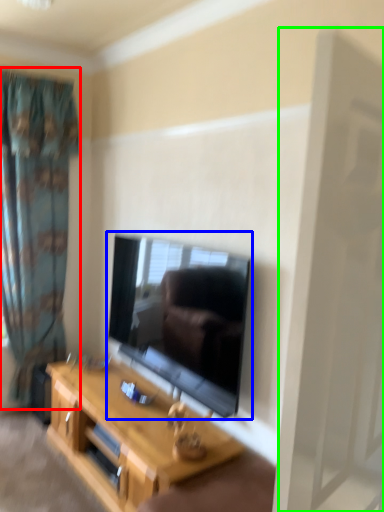
Question: Which object is positioned farthest from curtain (highlighted by a red box)? Select from television (highlighted by a blue box) and screen door (highlighted by a green box).

Choices:
 (A) television
 (B) screen door

Answer: (B)